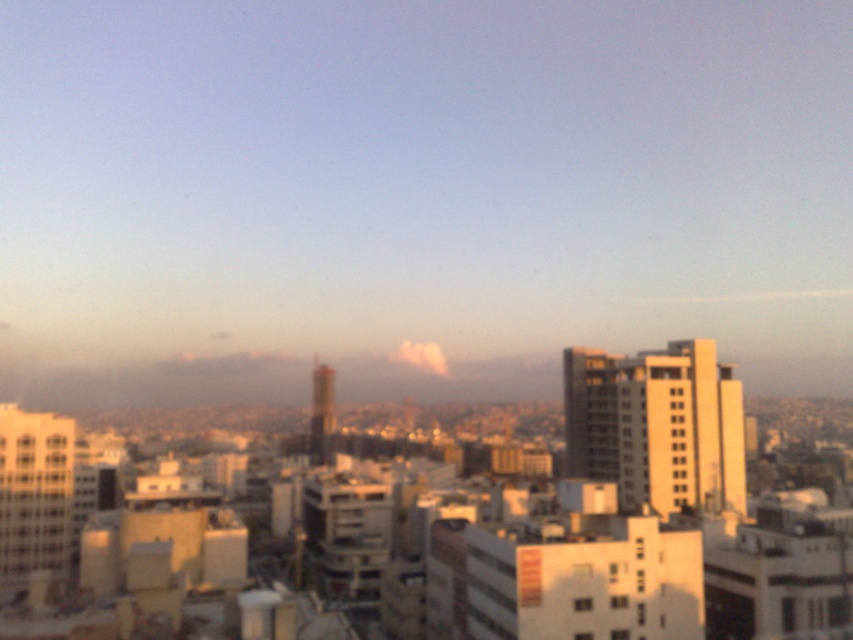
Does white matte building at center appear on the right side of yellow concrete building at right?

No, white matte building at center is not to the right of yellow concrete building at right.

Who is more forward, (223,566) or (744,500)?

Point (223,566) is more forward.

Identify the location of white matte building at center. (643, 525).